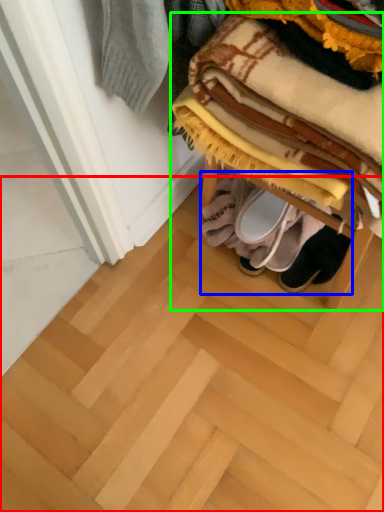
Question: Which object is positioned farthest from stair (highlighted by a red box)? Select from footwear (highlighted by a blue box) and furniture (highlighted by a green box).

Choices:
 (A) footwear
 (B) furniture

Answer: (B)